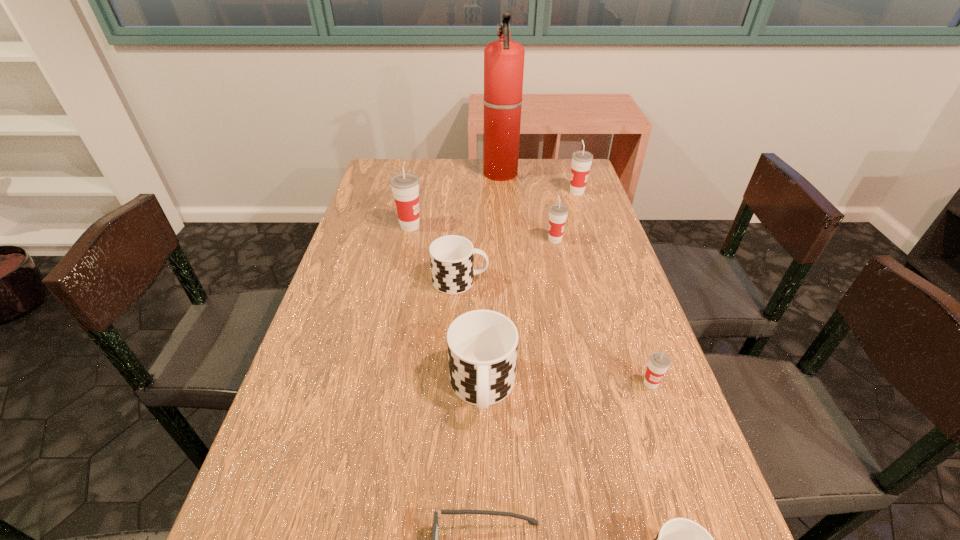
Where is `red cup that is the second nearest to the fourth nearest cup`? This screenshot has width=960, height=540. red cup that is the second nearest to the fourth nearest cup is located at coordinates (558, 212).

Choose which red cup is the nearest neighbor to the third nearest red cup. Please provide its 2D coordinates. Your answer should be formatted as a tuple, i.e. [(x, y)], where the tuple contains the x and y coordinates of a point satisfying the conditions above.

[(558, 212)]

Locate which black cup is the closest to the farthest red cup. Please provide its 2D coordinates. Your answer should be formatted as a tuple, i.e. [(x, y)], where the tuple contains the x and y coordinates of a point satisfying the conditions above.

[(452, 257)]

Identify which black cup is the third closest to the seventh nearest object. Please provide its 2D coordinates. Your answer should be formatted as a tuple, i.e. [(x, y)], where the tuple contains the x and y coordinates of a point satisfying the conditions above.

[(679, 539)]